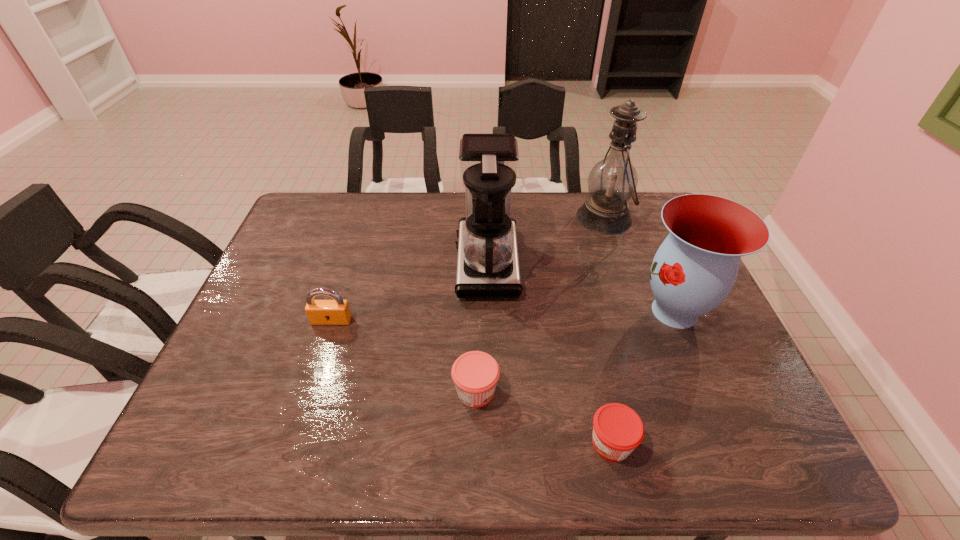
This screenshot has width=960, height=540. Identify the location of free space located 0.310m at the front of the coffee maker where the controls are located. (348, 262).

I want to click on free region located at the front of the coffee maker where the controls are located, so click(x=383, y=262).

I want to click on vacant region located at the front of the coffee maker where the controls are located, so click(x=370, y=262).

Where is `free space located 0.160m on the left of the vase`? free space located 0.160m on the left of the vase is located at coordinates (571, 312).

This screenshot has width=960, height=540. What are the coordinates of `free space located to unlock the third shortest object from the front` in the screenshot? It's located at (305, 404).

At what (x,y) coordinates should I click in order to perform the action: click on vacant space located on the front label of the farther jam. Please return your answer as a coordinate pair (x, y). Looking at the image, I should click on (580, 391).

You are a GUI agent. You are given a task and a screenshot of the screen. Output one action in this format:
    pyautogui.click(x=<x>, y=<y>)
    Task: Click on the free spot located 0.120m on the label side of the nearer jam
    This screenshot has width=960, height=540.
    Given the screenshot: What is the action you would take?
    pyautogui.click(x=528, y=443)

This screenshot has height=540, width=960. I want to click on blank space located 0.270m on the label side of the nearer jam, so click(454, 443).

What are the coordinates of `vacant area situated 0.340m on the label side of the nearer jam` in the screenshot? It's located at (420, 443).

Image resolution: width=960 pixels, height=540 pixels. Find the location of `oil lamp at the far edge`. oil lamp at the far edge is located at coordinates (611, 183).